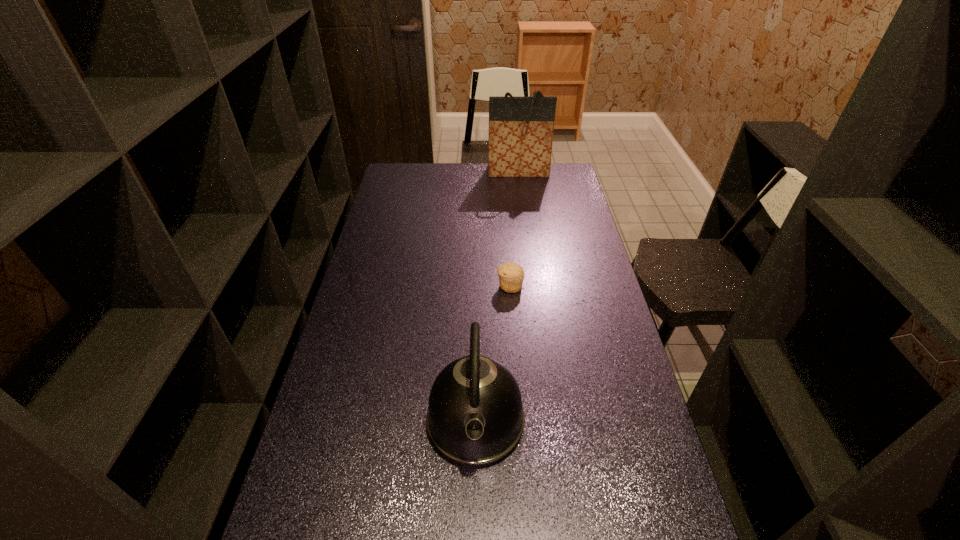
Select which object appears as the closest to the tallest object. Please provide its 2D coordinates. Your answer should be formatted as a tuple, i.e. [(x, y)], where the tuple contains the x and y coordinates of a point satisfying the conditions above.

[(511, 275)]

Choose which object is the second nearest neighbor to the kettle. Please provide its 2D coordinates. Your answer should be formatted as a tuple, i.e. [(x, y)], where the tuple contains the x and y coordinates of a point satisfying the conditions above.

[(521, 129)]